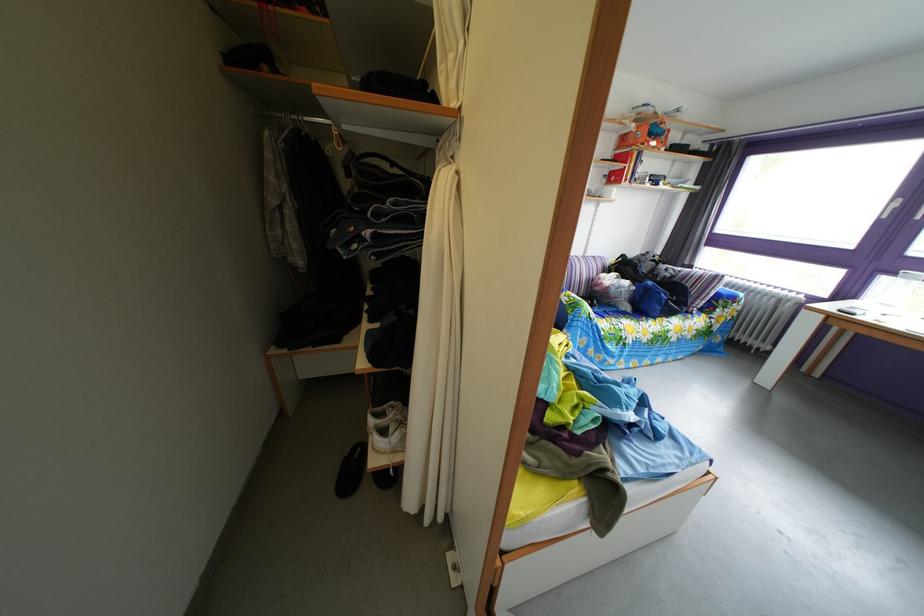
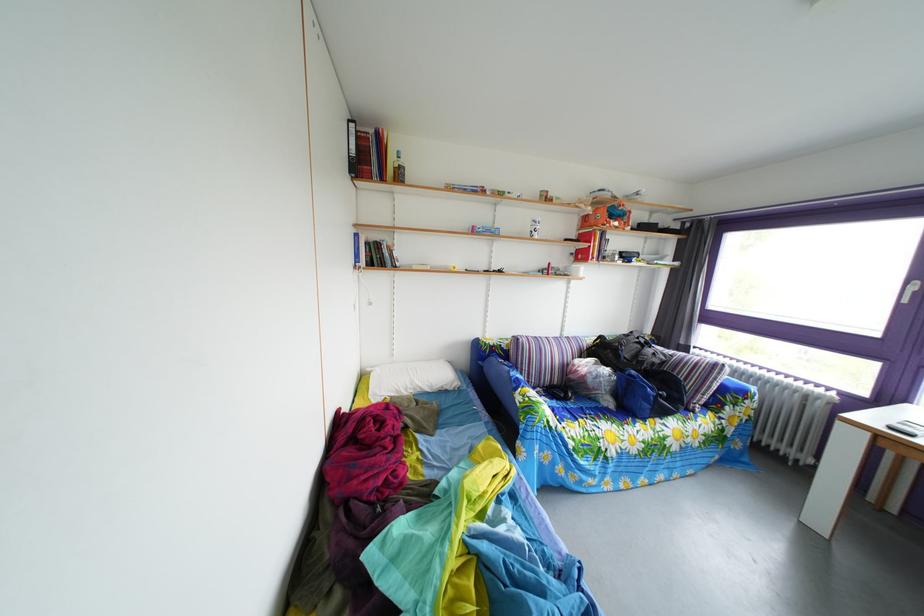
In a continuous first-person perspective shot, in which direction is the camera moving?

The cameraman moved toward right, forward.